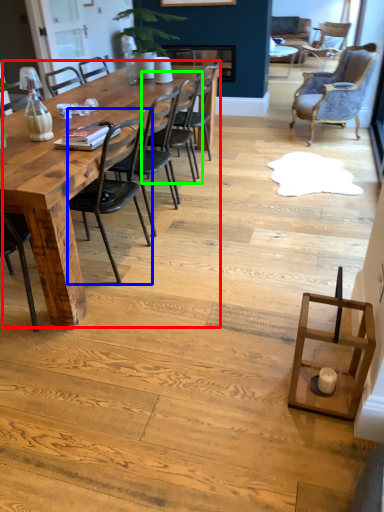
Question: Which object is positioned closest to kitchen & dining room table (highlighted by a red box)? Select from chair (highlighted by a blue box) and chair (highlighted by a green box).

Choices:
 (A) chair
 (B) chair

Answer: (A)